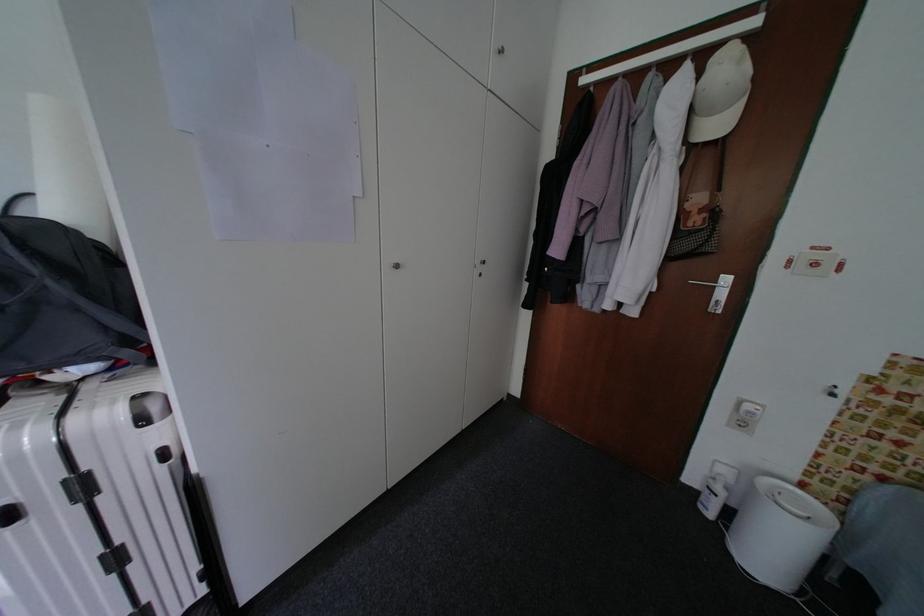
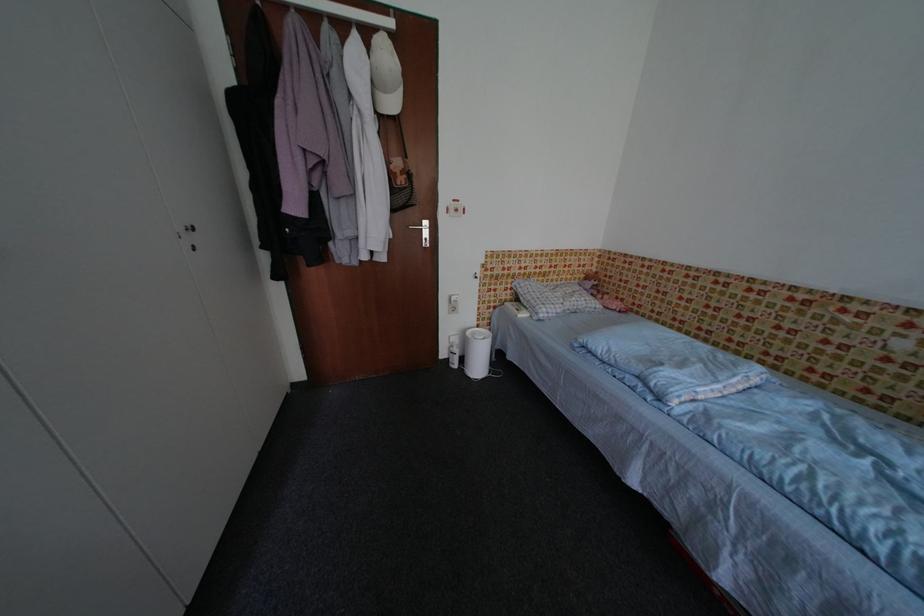
Locate, in the second image, the point that corresponds to (x=735, y=476) in the first image.

(464, 342)